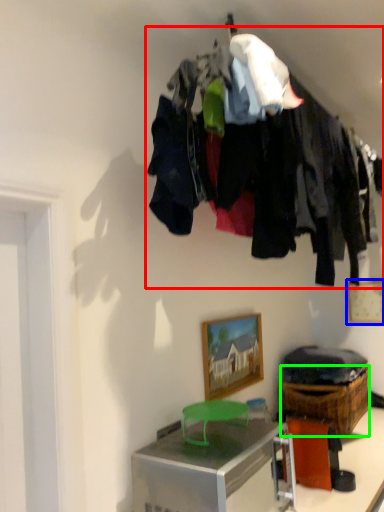
Question: Which object is the farthest from closet (highlighted by a red box)? Choose among these: picture frame (highlighted by a blue box) or crate (highlighted by a green box).

Choices:
 (A) picture frame
 (B) crate

Answer: (A)